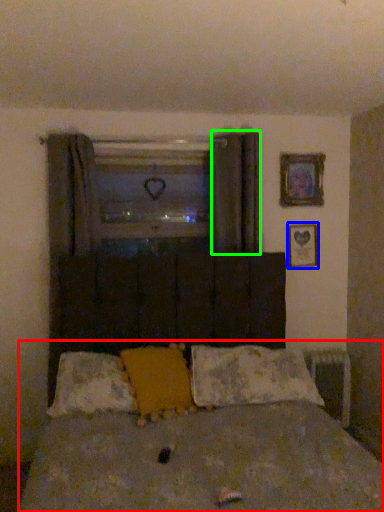
Question: Estimate the real-world distances between objects in this image. Which object is closer to bed (highlighted by a red box), picture frame (highlighted by a blue box) or curtain (highlighted by a green box)?

Choices:
 (A) picture frame
 (B) curtain

Answer: (B)